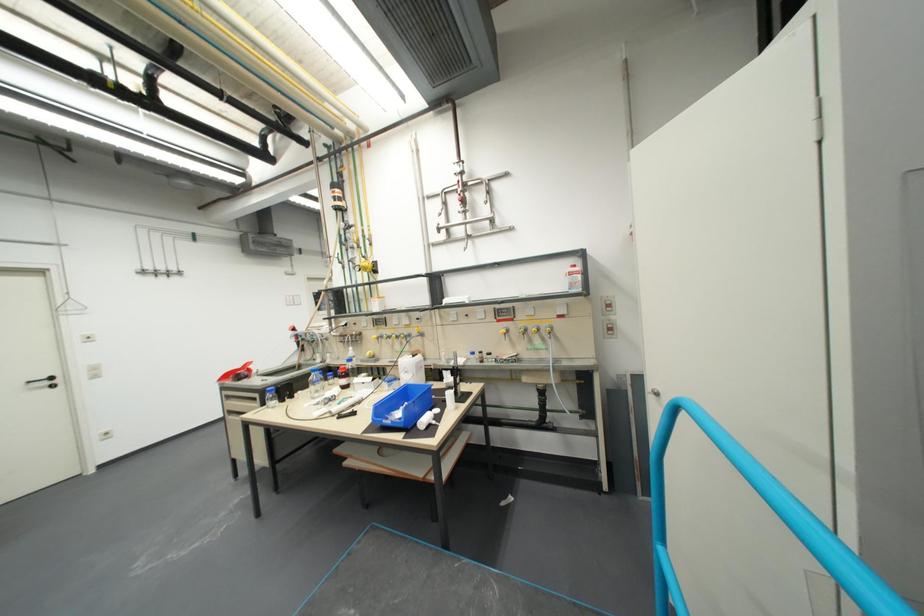
You are a GUI agent. You are given a task and a screenshot of the screen. Output one action in this format:
    pyautogui.click(x=<x>, y=<y>)
    Task: Click on the faucet lever handle
    
    Given the screenshot: What is the action you would take?
    pyautogui.click(x=504, y=331)